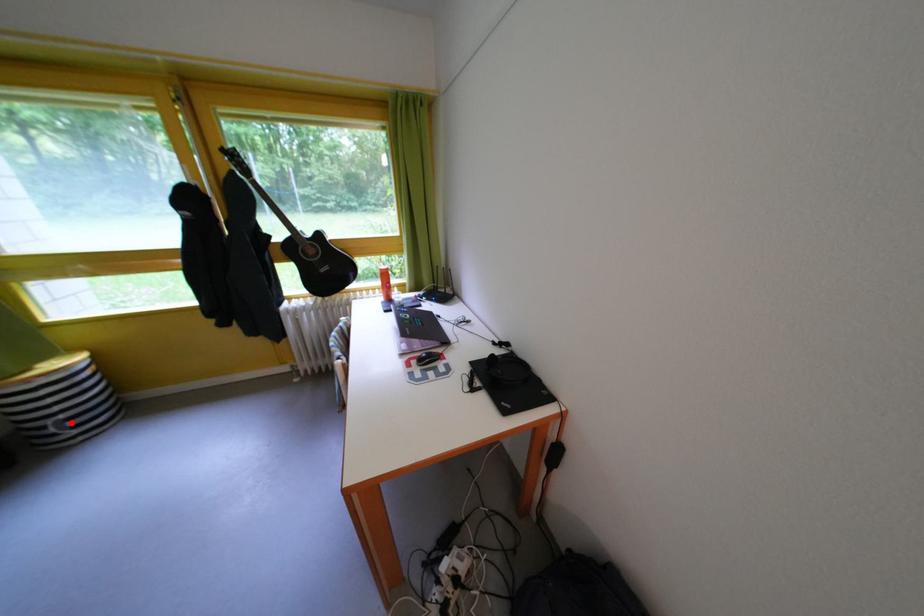
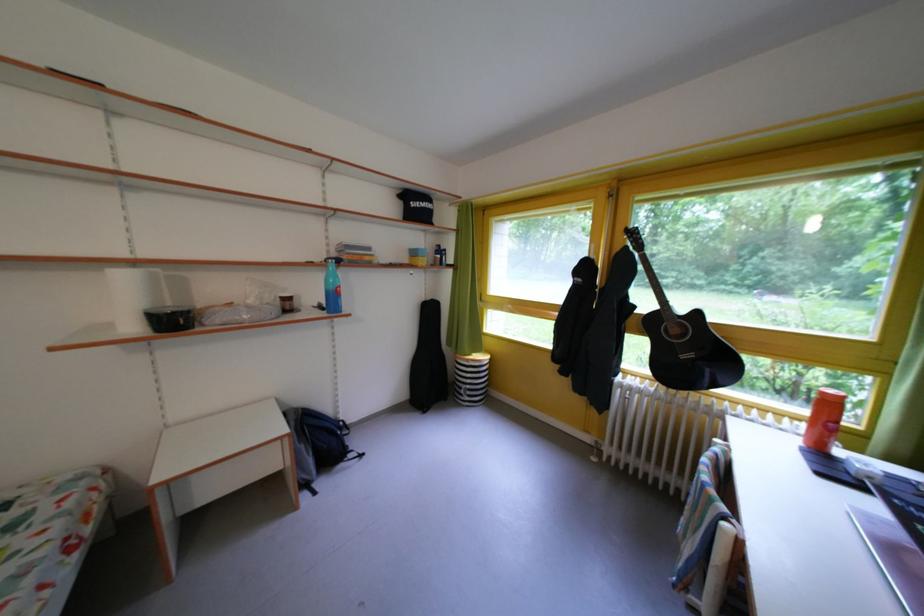
Find the pixel in the second image that matches the highlighted location in the first image.

(478, 392)